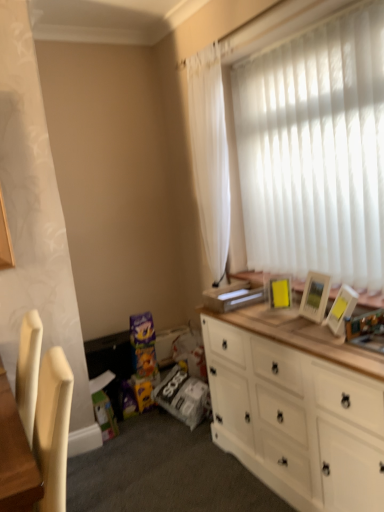
Question: From a real-world perspective, is yellow matte picture frame at upper right, the first picture frame from the left, physically located above or below white glossy picture frame at upper right, which is counted as the 1th picture frame, starting from the front?

Choices:
 (A) below
 (B) above

Answer: (B)

Question: Is yellow matte picture frame at upper right, which appears as the second picture frame when viewed from the front, wider or thinner than white glossy picture frame at upper right, the first picture frame in the right-to-left sequence?

Choices:
 (A) wide
 (B) thin

Answer: (B)

Question: Which object is the closest to the yellow matte picture frame at upper right, which appears as the 1th picture frame when viewed from the back?

Choices:
 (A) white wood cabinet at right
 (B) white sheer curtain at upper right
 (C) white glossy picture frame at upper right, the first picture frame in the right-to-left sequence

Answer: (C)

Question: Considering the real-world distances, which object is farthest from the white sheer curtain at upper right?

Choices:
 (A) white glossy picture frame at upper right, the first picture frame in the right-to-left sequence
 (B) yellow matte picture frame at upper right, which appears as the second picture frame when viewed from the front
 (C) white wood cabinet at right

Answer: (A)